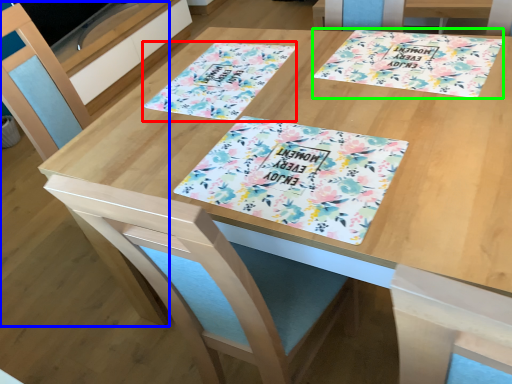
Question: Considering the real-world distances, which object is closest to flyer (highlighted by a red box)? chair (highlighted by a blue box) or tablecloth (highlighted by a green box).

Choices:
 (A) chair
 (B) tablecloth

Answer: (B)